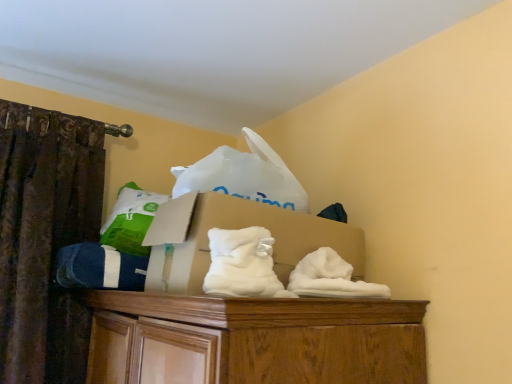
Question: From a real-world perspective, is white fluffy sheet at center positioned above or below blue cotton socks at left?

Choices:
 (A) above
 (B) below

Answer: (A)

Question: Is white fluffy sheet at center inside the boundaries of blue cotton socks at left, or outside?

Choices:
 (A) inside
 (B) outside

Answer: (B)

Question: Based on their relative distances, which object is nearer to the white fluffy sheet at center?

Choices:
 (A) blue cotton socks at left
 (B) cardboard box at center

Answer: (B)

Question: Estimate the real-world distances between objects in this image. Which object is farther from the cardboard box at center?

Choices:
 (A) white fluffy sheet at center
 (B) blue cotton socks at left

Answer: (B)